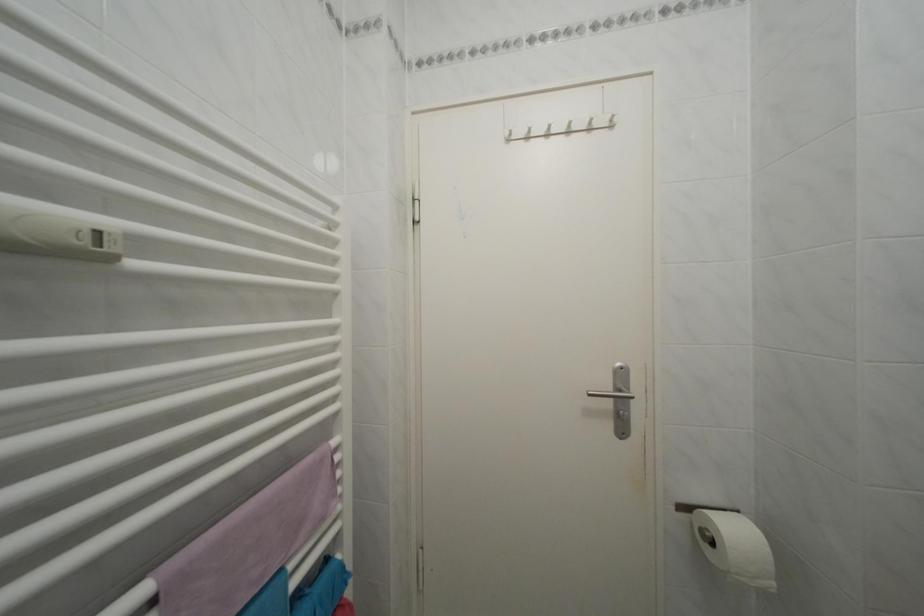
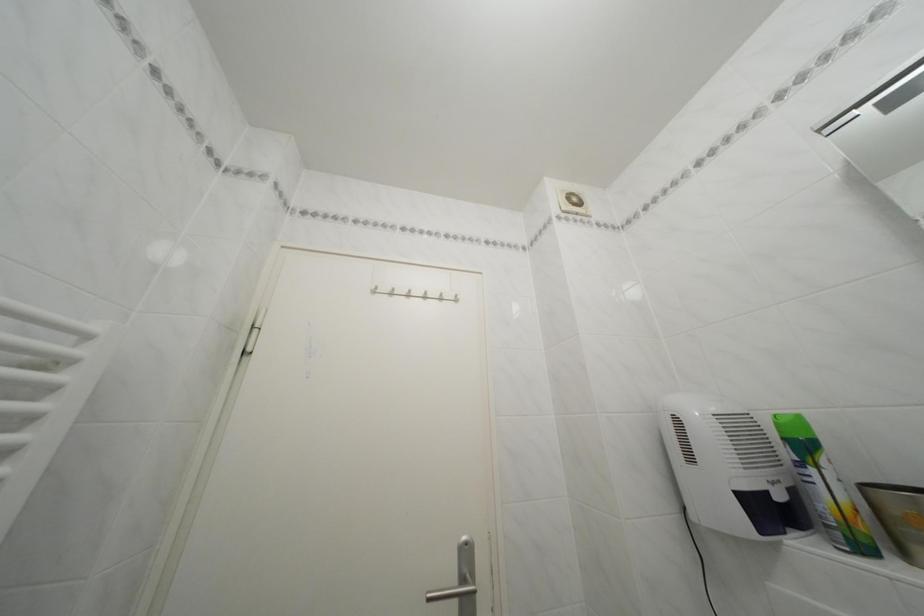
Find the pixel in the second image that matches the point at 518,140 in the first image.

(385, 294)